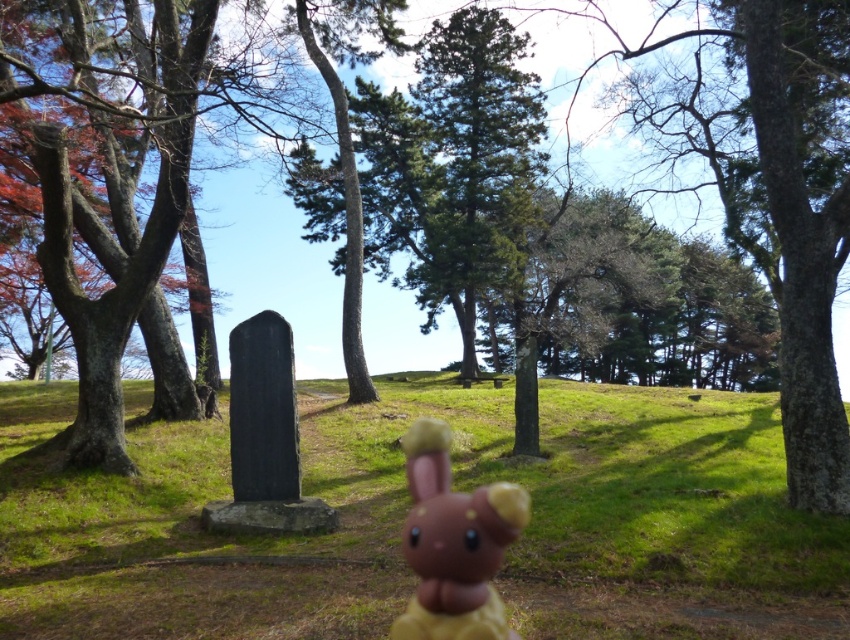
You are standing in the scene and want to place a 3.5 meter long banner between you and the green grassy at center. Can you fit the banner without it overlapping the grass?

The distance between you and the green grassy at center is 3.68 meters, so a 3.5 meter long banner can be placed between you and the grass without overlapping since it is shorter than the available space.

You are a photographer trying to capture the brown matte plush toy at center in the image. Since the green grassy at center is blocking the view, can you determine if you can see the toy clearly from your current position?

The green grassy at center is much taller than the brown matte plush toy at center, so the grass is blocking the view of the toy. You cannot see the toy clearly from your current position.

You are a hiker who has just arrived at the park and wants to place a 3 feet wide picnic basket between the green grassy at center and the brown matte plush toy at center. Can you fit it there?

The distance between the green grassy at center and the brown matte plush toy at center is 21.58 feet. Since the picnic basket is only 3 feet wide, there is enough space to place it between them.